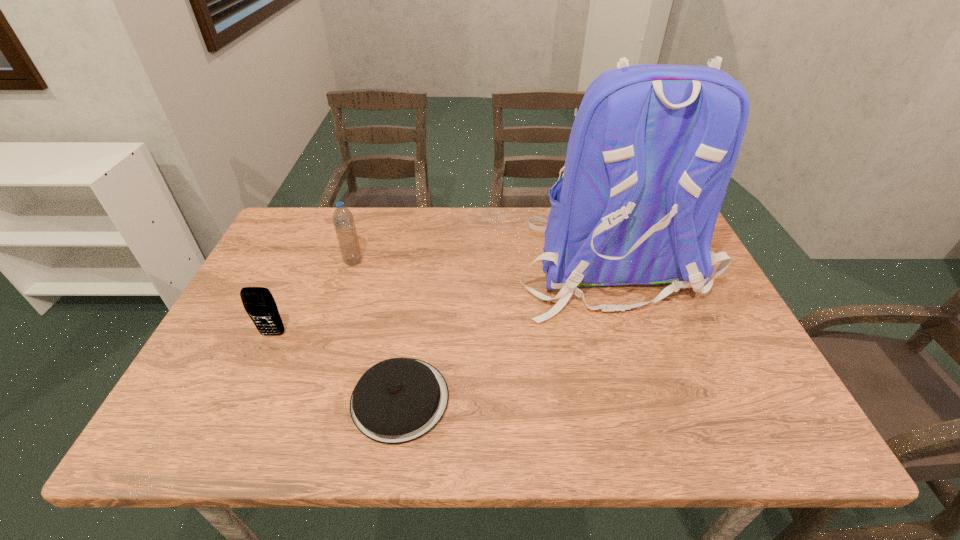
The image size is (960, 540). In the image, there is a desktop. Find the location of `vacant space at the near right corner`. vacant space at the near right corner is located at coordinates (734, 410).

Image resolution: width=960 pixels, height=540 pixels. In order to click on free space between the pancake and the second shortest object in this screenshot , I will do `click(337, 367)`.

The width and height of the screenshot is (960, 540). I want to click on free spot between the third object from right to left and the shortest object, so click(x=376, y=330).

You are a GUI agent. You are given a task and a screenshot of the screen. Output one action in this format:
    pyautogui.click(x=<x>, y=<y>)
    Task: Click on the vacant space in between the second shortest object and the third shortest object
    
    Given the screenshot: What is the action you would take?
    pyautogui.click(x=313, y=298)

Where is `free space between the backpack and the third shortest object`? This screenshot has height=540, width=960. free space between the backpack and the third shortest object is located at coordinates (480, 263).

Where is `free spot between the second tallest object and the rightmost object`? free spot between the second tallest object and the rightmost object is located at coordinates (480, 263).

Find the location of `blank region between the shortest object and the water bottle`. blank region between the shortest object and the water bottle is located at coordinates (376, 330).

The width and height of the screenshot is (960, 540). What are the coordinates of `free space between the tallest object and the pancake` in the screenshot? It's located at (504, 332).

Identify the location of empty space between the second object from left to right and the tallest object. (480, 263).

Identify the location of free point between the backpack and the water bottle. The image size is (960, 540). (480, 263).